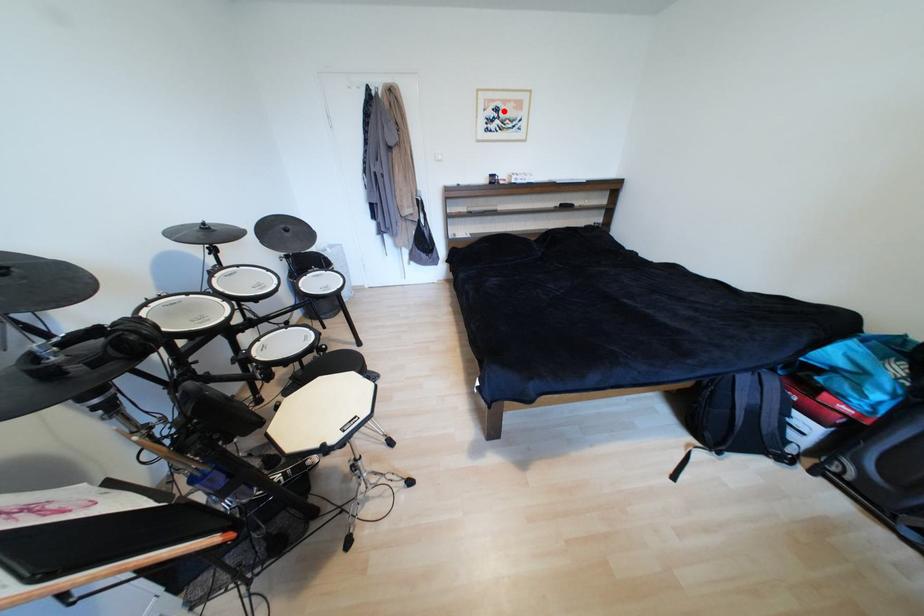
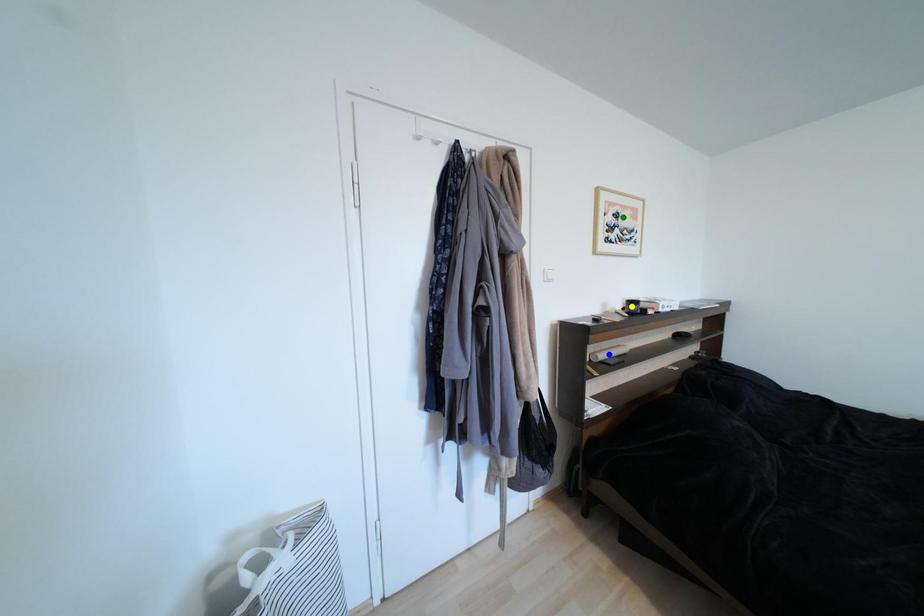
Question: I am providing you with two images of the same scene from different viewpoints. A red point is marked on the first image. You are given multiple points on the second image. In image 2, which mark is for the same physical point as the one in image 1?

Choices:
 (A) green point
 (B) blue point
 (C) yellow point

Answer: (A)